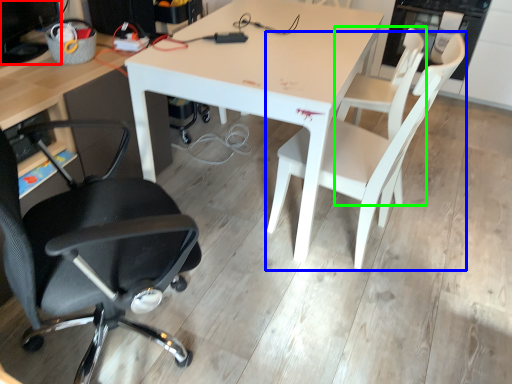
Question: Based on their relative distances, which object is nearer to computer monitor (highlighted by a red box)? Choose from chair (highlighted by a blue box) and chair (highlighted by a green box).

Choices:
 (A) chair
 (B) chair

Answer: (A)